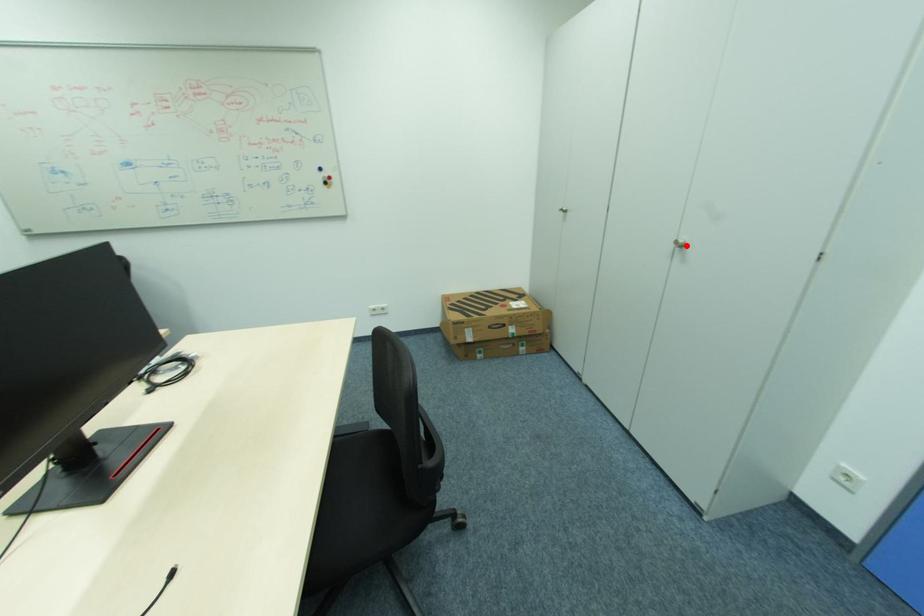
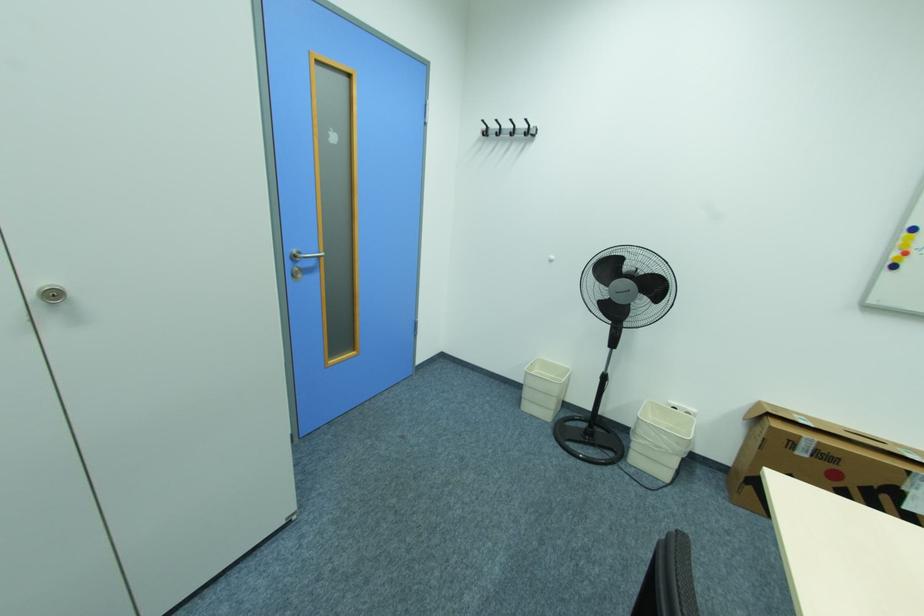
The point at the highlighted location is marked in the first image. Where is the corresponding point in the second image?

(64, 294)